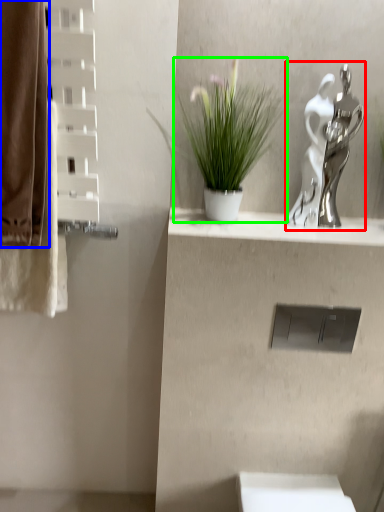
Question: Based on their relative distances, which object is farther from sculpture (highlighted by a red box)? Choose from curtain (highlighted by a blue box) and houseplant (highlighted by a green box).

Choices:
 (A) curtain
 (B) houseplant

Answer: (A)